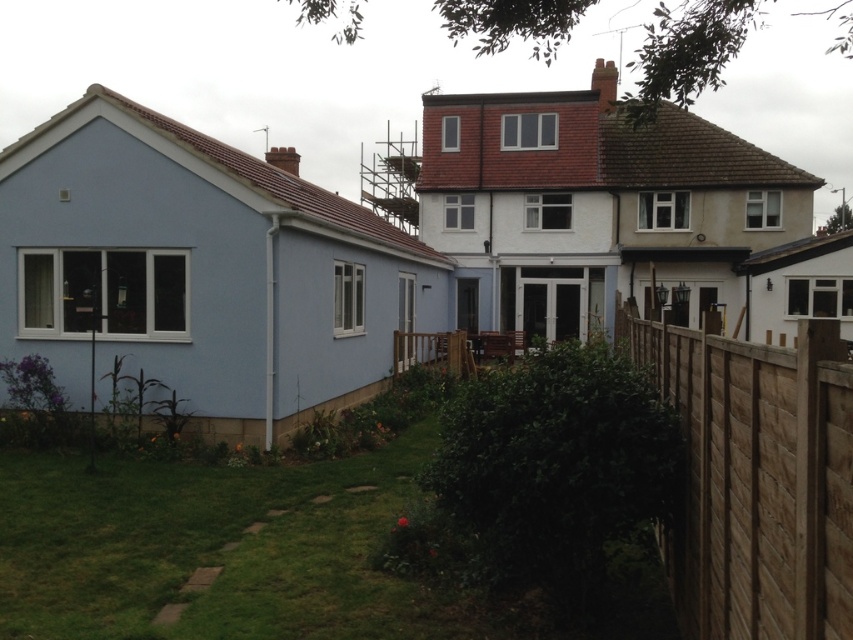
Find the location of `green grass at lower left`. green grass at lower left is located at coordinates (270, 554).

Measure the distance between green grass at lower left and camera.

green grass at lower left is 7.59 meters away from camera.

Between point (346, 592) and point (817, 554), which one is positioned in front?

Positioned in front is point (817, 554).

Locate an element on the screen. green grass at lower left is located at coordinates (270, 554).